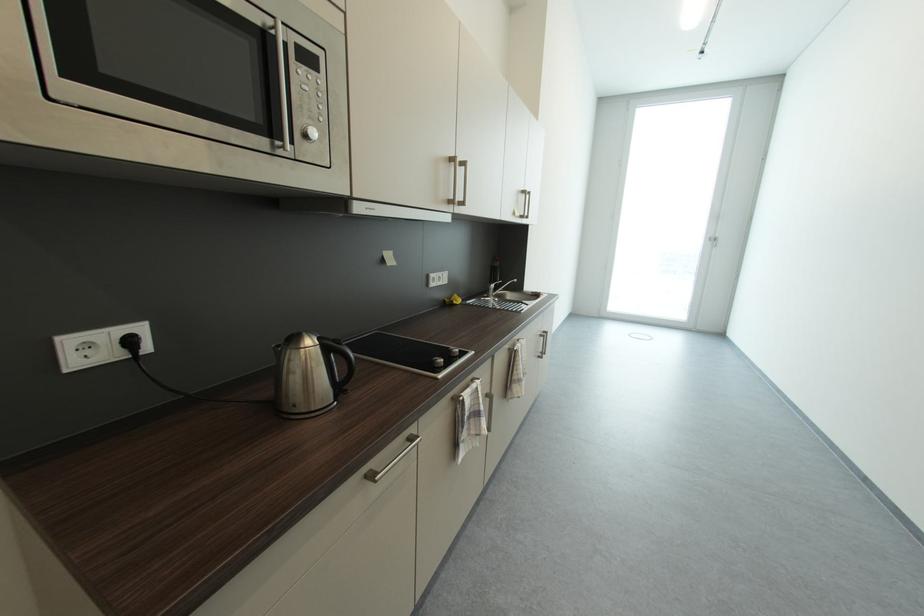
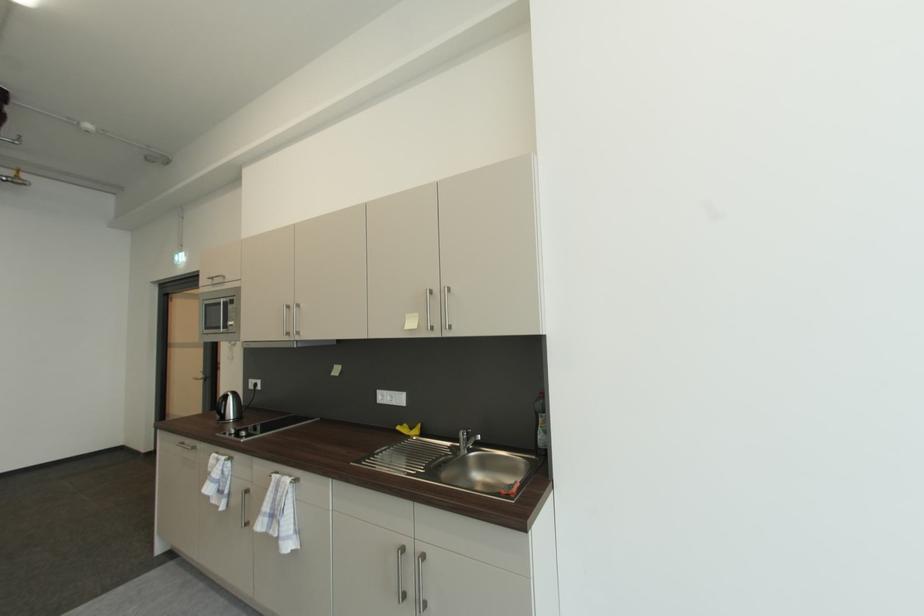
Where in the second image is the point corresponding to the point at 472,419 from the first image?

(215, 471)